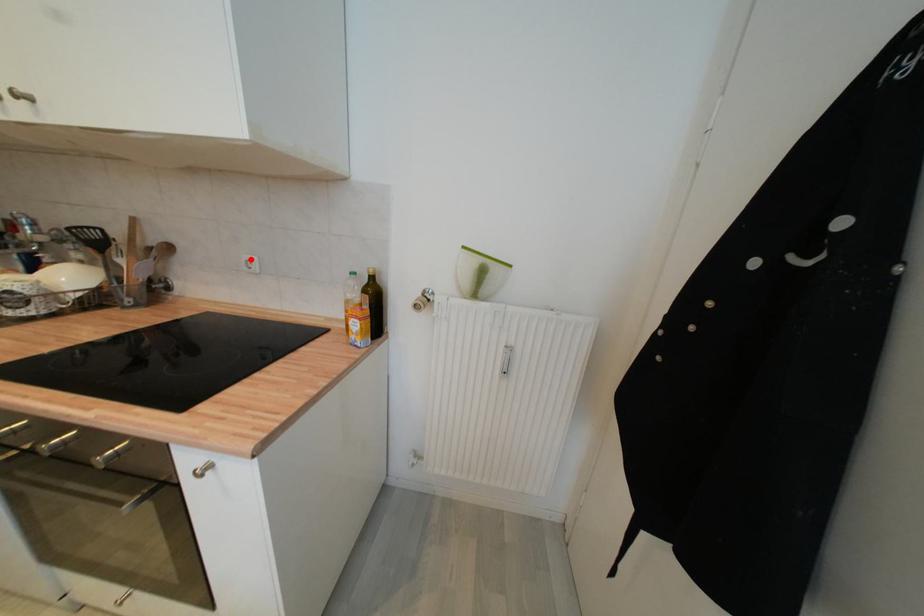
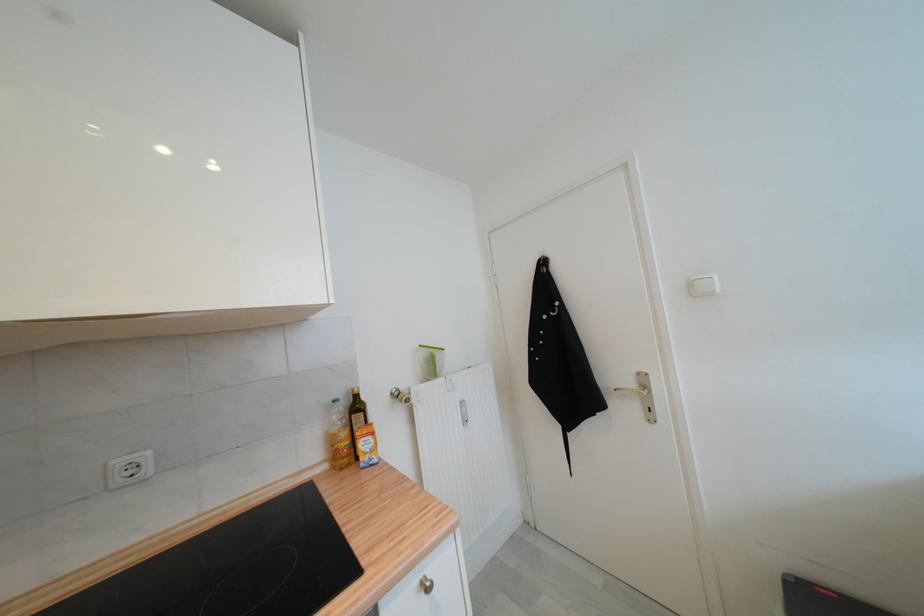
In the second image, find the point that corresponds to the highlighted location in the first image.

(126, 464)